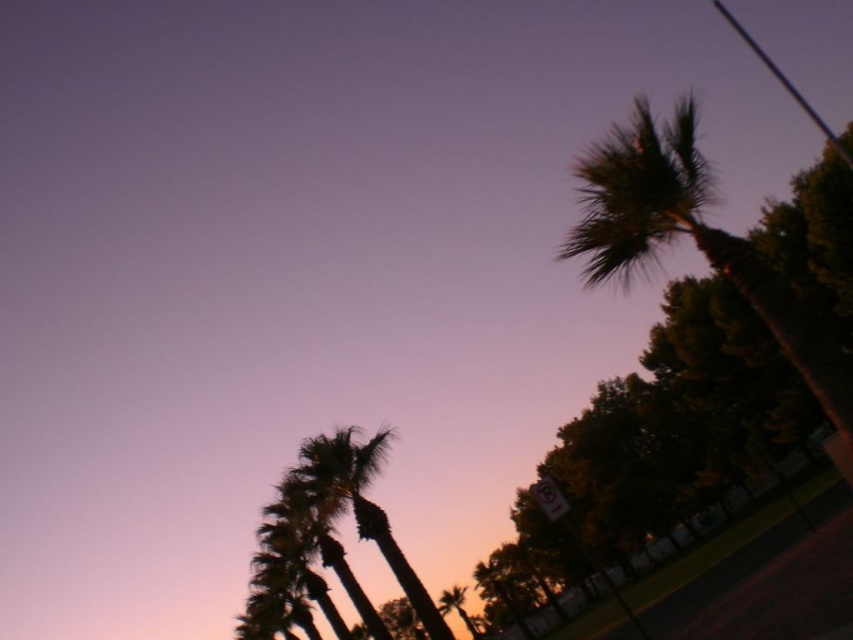
Question: Is dark green leafy palm tree at upper right closer to camera compared to silhouette leafy palm at lower left?

Choices:
 (A) no
 (B) yes

Answer: (B)

Question: Is dark green leafy palm tree at upper right smaller than silhouette leafy palm at lower left?

Choices:
 (A) yes
 (B) no

Answer: (B)

Question: Which object is farther from the camera taking this photo?

Choices:
 (A) dark green leafy palm tree at upper right
 (B) silhouette leafy palm at lower left

Answer: (B)

Question: Considering the relative positions of dark green leafy palm tree at upper right and silhouette leafy palm at lower left in the image provided, where is dark green leafy palm tree at upper right located with respect to silhouette leafy palm at lower left?

Choices:
 (A) above
 (B) below

Answer: (A)

Question: Which object appears farthest from the camera in this image?

Choices:
 (A) silhouette leafy palm at lower left
 (B) dark green leafy palm tree at upper right

Answer: (A)